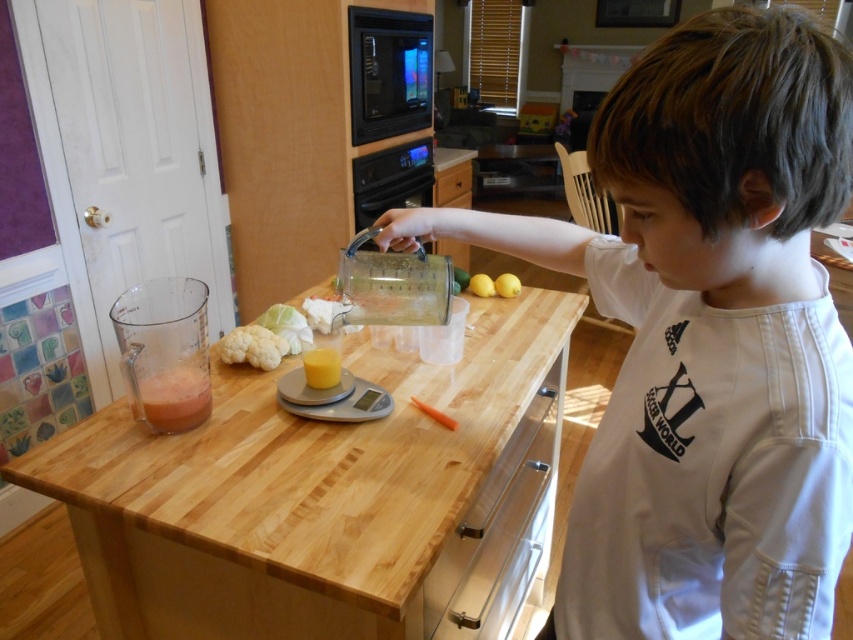
Does wooden table at center appear on the right side of translucent plastic cup at center?

Indeed, wooden table at center is positioned on the right side of translucent plastic cup at center.

Between wooden table at center and translucent plastic cup at center, which one appears on the right side from the viewer's perspective?

From the viewer's perspective, wooden table at center appears more on the right side.

Image resolution: width=853 pixels, height=640 pixels. What are the coordinates of `wooden table at center` in the screenshot? It's located at (296, 492).

Looking at this image, is wooden table at center positioned in front of translucent plastic blender at lower left?

That is True.

Is point (498, 420) less distant than point (196, 387)?

That is False.

At what (x,y) coordinates should I click in order to perform the action: click on wooden table at center. Please return your answer as a coordinate pair (x, y). The image size is (853, 640). Looking at the image, I should click on (296, 492).

Is white cotton shirt at upper right thinner than translucent plastic blender at lower left?

In fact, white cotton shirt at upper right might be wider than translucent plastic blender at lower left.

Can you confirm if white cotton shirt at upper right is positioned to the right of translucent plastic blender at lower left?

Yes, white cotton shirt at upper right is to the right of translucent plastic blender at lower left.

Is point (695, 556) in front of point (158, 332)?

Yes, point (695, 556) is closer to viewer.

Where is `white cotton shirt at upper right`? This screenshot has width=853, height=640. white cotton shirt at upper right is located at coordinates (706, 337).